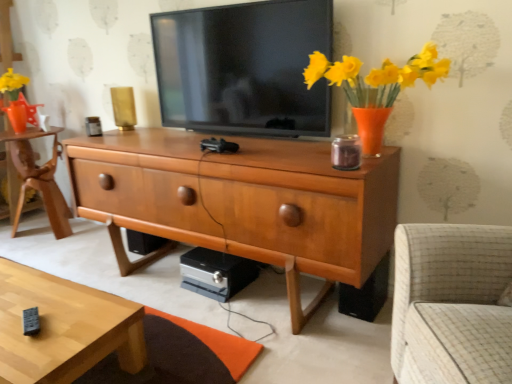
The image size is (512, 384). Identify the location of free location in front of black plastic speaker at lower right. (361, 330).